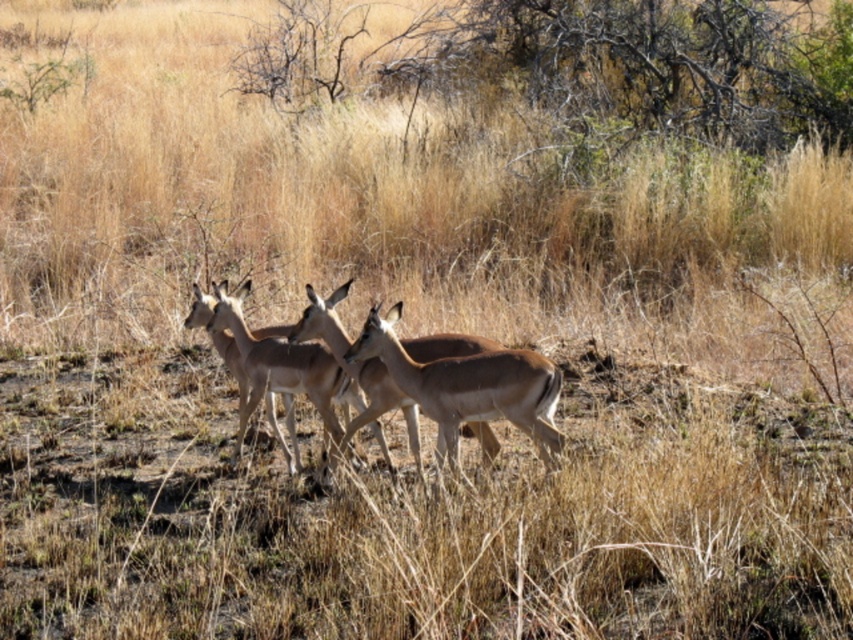
Based on the photo, you are a wildlife photographer trying to capture a closeup shot of the brown matte deer at center and the brown fur antelope at center. Since you want to focus on the smaller animal first, which one should you aim your camera at?

The brown matte deer at center is smaller than the brown fur antelope at center, so you should aim your camera at the brown matte deer at center first.

You are a wildlife photographer aiming to capture a clear photo of both the brown glossy antelope at center and the brown matte deer at center. Based on their positions, which animal should you focus on first to ensure both are in the frame?

You should focus on the brown glossy antelope at center first because the brown matte deer at center is behind it. By focusing on the front animal, you can adjust the camera to include both in the frame.

You are an animal researcher observing the two animals in the center of the savanna. Which one is located to the left when looking at the brown glossy antelope at center and the brown matte deer at center?

The brown glossy antelope at center is positioned to the left of the brown matte deer at center.